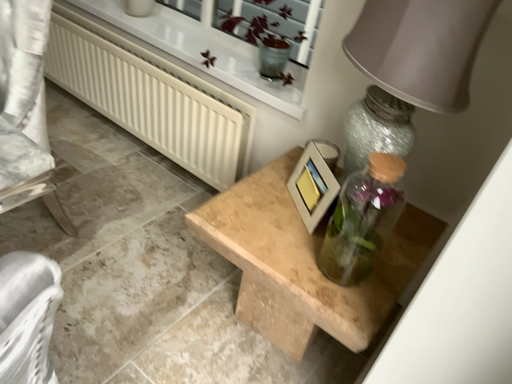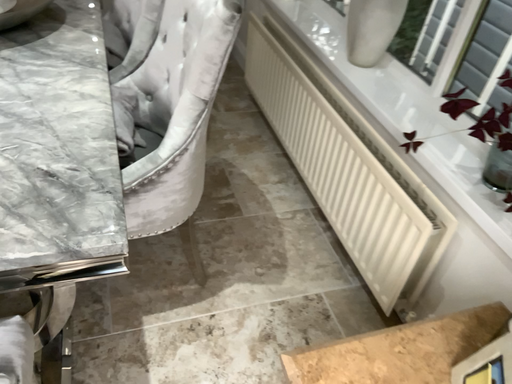
Question: How did the camera likely rotate when shooting the video?

Choices:
 (A) rotated downward
 (B) rotated upward

Answer: (B)